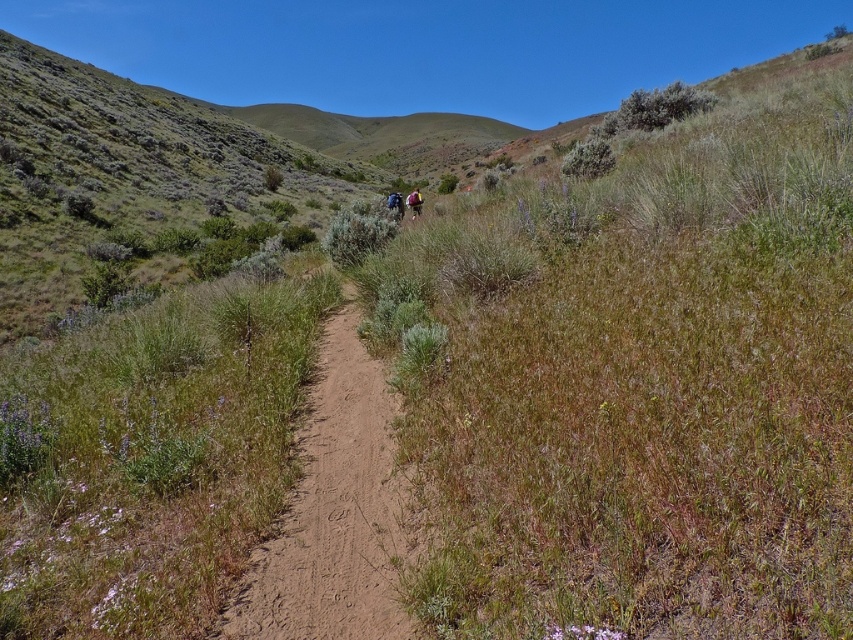
You are standing at the starting point of the dirt path in the valley. You see two points marked on the ground ahead of you. One is at point coordinates point (413, 212) and the other is at point (392, 193). Which point is closer to you?

Point (413, 212) is closer to the viewer than point (392, 193).

You are a hiker preparing to pack your gear for a day hike in the described valley. You have both a camouflage backpack at center and a dark blue backpack at center. If you want to carry more items, which backpack should you choose based on their sizes?

The dark blue backpack at center is larger since the camouflage backpack at center occupies less space than it, so choosing the dark blue backpack at center allows you to carry more items.